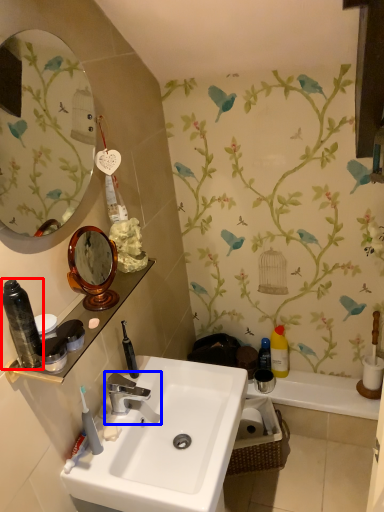
Question: Which point is further to the camera, toiletry (highlighted by a red box) or tap (highlighted by a blue box)?

Choices:
 (A) toiletry
 (B) tap

Answer: (B)